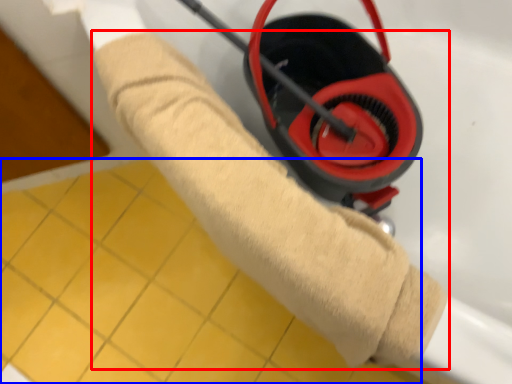
Question: Among these objects, which one is farthest to the camera, towel (highlighted by a red box) or tile (highlighted by a blue box)?

Choices:
 (A) towel
 (B) tile

Answer: (B)